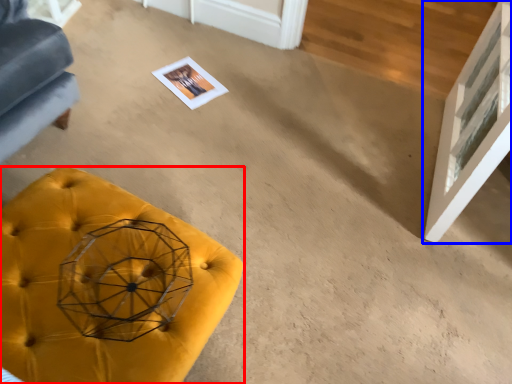
Question: Among these objects, which one is nearest to the camera, furniture (highlighted by a red box) or glass door (highlighted by a blue box)?

Choices:
 (A) furniture
 (B) glass door

Answer: (A)